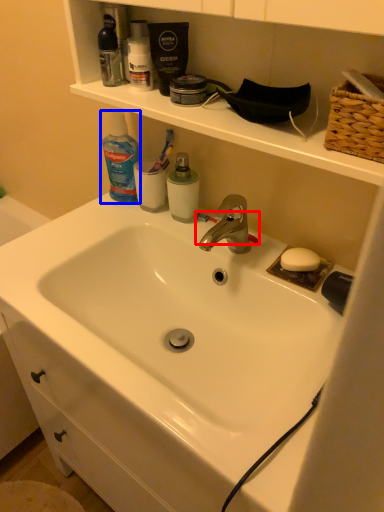
Question: Which point is further to the camera, toothbrush (highlighted by a red box) or cleaning product (highlighted by a blue box)?

Choices:
 (A) toothbrush
 (B) cleaning product

Answer: (A)